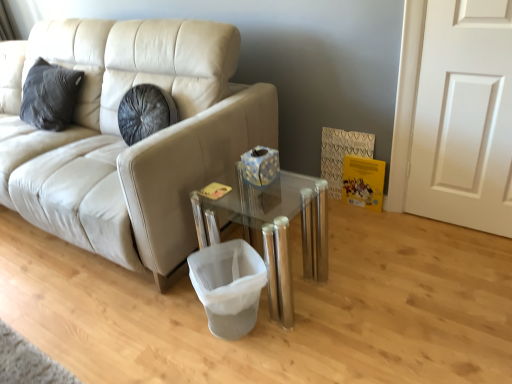
Question: From a real-world perspective, is white matte door at right positioned over transparent glass table at center based on gravity?

Choices:
 (A) no
 (B) yes

Answer: (B)

Question: Considering the relative sizes of white matte door at right and transparent glass table at center in the image provided, is white matte door at right smaller than transparent glass table at center?

Choices:
 (A) yes
 (B) no

Answer: (A)

Question: Is white matte door at right shorter than transparent glass table at center?

Choices:
 (A) no
 (B) yes

Answer: (A)

Question: Is white matte door at right further to camera compared to transparent glass table at center?

Choices:
 (A) no
 (B) yes

Answer: (B)

Question: Considering the relative positions of white matte door at right and transparent glass table at center in the image provided, is white matte door at right to the left of transparent glass table at center from the viewer's perspective?

Choices:
 (A) no
 (B) yes

Answer: (A)

Question: Is white matte door at right facing away from transparent glass table at center?

Choices:
 (A) no
 (B) yes

Answer: (A)

Question: Is white fabric laundry basket at lower center outside of transparent glass table at center?

Choices:
 (A) no
 (B) yes

Answer: (A)

Question: From a real-world perspective, is white fabric laundry basket at lower center physically below transparent glass table at center?

Choices:
 (A) yes
 (B) no

Answer: (A)

Question: Is white fabric laundry basket at lower center to the left of transparent glass table at center from the viewer's perspective?

Choices:
 (A) no
 (B) yes

Answer: (B)

Question: Does white fabric laundry basket at lower center have a larger size compared to transparent glass table at center?

Choices:
 (A) yes
 (B) no

Answer: (B)

Question: Would you say white fabric laundry basket at lower center is a long distance from transparent glass table at center?

Choices:
 (A) no
 (B) yes

Answer: (A)

Question: Is white fabric laundry basket at lower center at the right side of transparent glass table at center?

Choices:
 (A) no
 (B) yes

Answer: (A)

Question: From a real-world perspective, is beige leather couch at left positioned over white fabric laundry basket at lower center based on gravity?

Choices:
 (A) yes
 (B) no

Answer: (A)